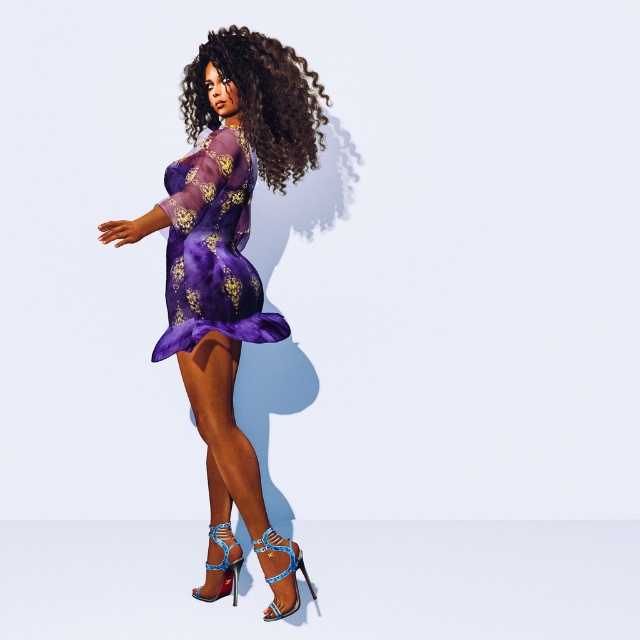
Question: Can you confirm if curly hair at upper center is bigger than blue patent leather sandal at lower center?

Choices:
 (A) no
 (B) yes

Answer: (B)

Question: Is blue metallic sandal at lower center wider than blue patent leather sandal at lower center?

Choices:
 (A) no
 (B) yes

Answer: (B)

Question: Does purple satin dress at center have a smaller size compared to blue metallic sandal at lower center?

Choices:
 (A) no
 (B) yes

Answer: (A)

Question: Which point appears farthest from the camera in this image?

Choices:
 (A) (236, 544)
 (B) (266, 608)

Answer: (A)

Question: Which is nearer to the purple satin dress at center?

Choices:
 (A) curly hair at upper center
 (B) blue metallic sandal at lower center
 (C) blue patent leather sandal at lower center

Answer: (A)

Question: Among these objects, which one is nearest to the camera?

Choices:
 (A) purple satin dress at center
 (B) blue metallic sandal at lower center

Answer: (A)